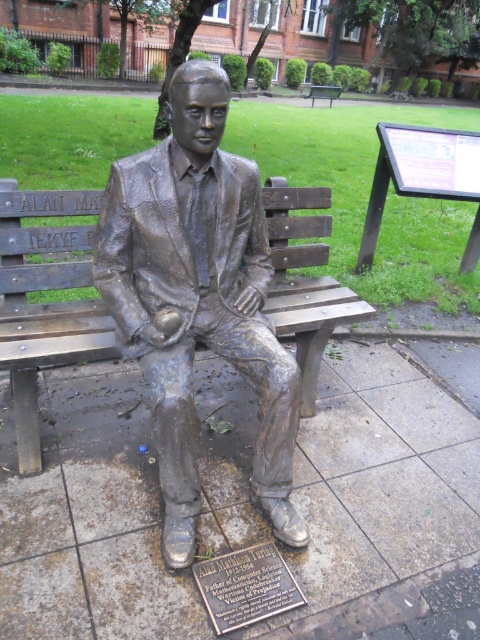
Which is more to the right, bronze statue at center or bronze wood bench at center?

From the viewer's perspective, bronze statue at center appears more on the right side.

Is bronze statue at center further to the viewer compared to bronze wood bench at center?

No, bronze statue at center is closer to the viewer.

At what (x,y) coordinates should I click in order to perform the action: click on bronze statue at center. Please return your answer as a coordinate pair (x, y). This screenshot has width=480, height=640. Looking at the image, I should click on (199, 298).

Can you confirm if bronze statue at center is smaller than bronze plaque at center?

No, bronze statue at center is not smaller than bronze plaque at center.

Can you confirm if bronze statue at center is wider than bronze plaque at center?

Correct, the width of bronze statue at center exceeds that of bronze plaque at center.

What do you see at coordinates (199, 298) in the screenshot? Image resolution: width=480 pixels, height=640 pixels. I see `bronze statue at center` at bounding box center [199, 298].

This screenshot has width=480, height=640. What are the coordinates of `bronze statue at center` in the screenshot? It's located at (199, 298).

Is bronze wood bench at center above bronze plaque at center?

Indeed, bronze wood bench at center is positioned over bronze plaque at center.

At what (x,y) coordinates should I click in order to perform the action: click on bronze wood bench at center. Please return your answer as a coordinate pair (x, y). Looking at the image, I should click on pyautogui.click(x=45, y=301).